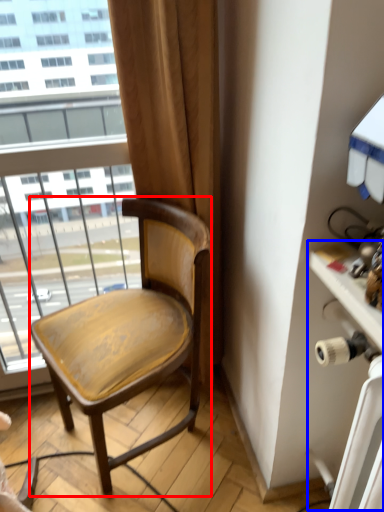
Question: Which object appears farthest to the camera in this image, chair (highlighted by a red box) or table (highlighted by a blue box)?

Choices:
 (A) chair
 (B) table

Answer: (A)